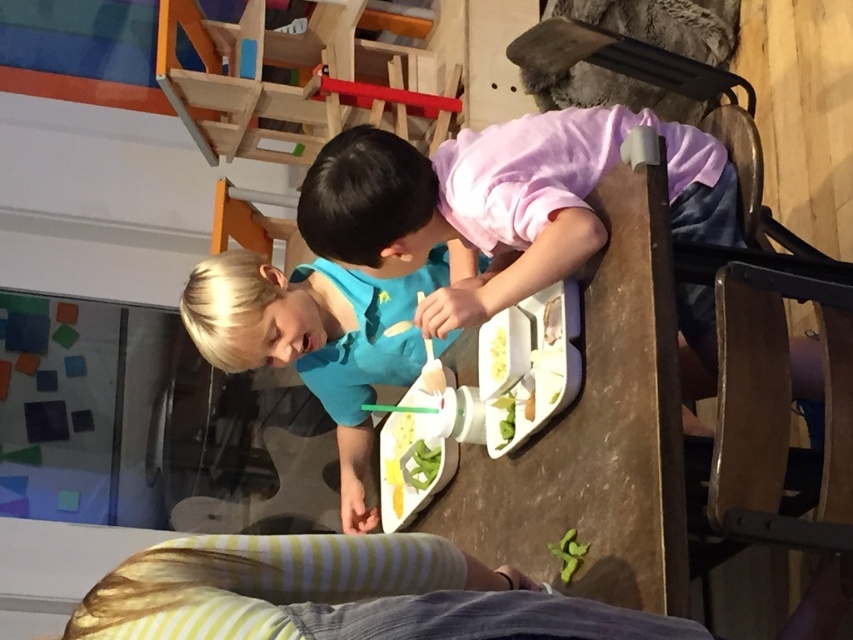
Is green matte vegetable at center further to camera compared to white matte plate at center?

Yes, it is behind white matte plate at center.

Is green matte vegetable at center below white matte plate at center?

Indeed, green matte vegetable at center is positioned under white matte plate at center.

Which is behind, point (415, 445) or point (500, 353)?

The point (415, 445) is behind.

At what (x,y) coordinates should I click in order to perform the action: click on green matte vegetable at center. Please return your answer as a coordinate pair (x, y). The width and height of the screenshot is (853, 640). Looking at the image, I should click on (422, 465).

Is blue matte shirt at center taller than white matte food at center?

Indeed, blue matte shirt at center has a greater height compared to white matte food at center.

Who is more forward, (425,288) or (422,378)?

Point (422,378)

Is point (283, 282) less distant than point (421, 376)?

That is True.

This screenshot has height=640, width=853. In order to click on blue matte shirt at center in this screenshot , I will do `click(316, 339)`.

Is point (335, 150) positioned behind point (503, 372)?

No, it is in front of (503, 372).

Can you confirm if blue matte shirt at center is positioned to the right of white matte plate at center?

Incorrect, blue matte shirt at center is not on the right side of white matte plate at center.

The height and width of the screenshot is (640, 853). What do you see at coordinates (316, 339) in the screenshot?
I see `blue matte shirt at center` at bounding box center [316, 339].

What are the coordinates of `blue matte shirt at center` in the screenshot? It's located at (316, 339).